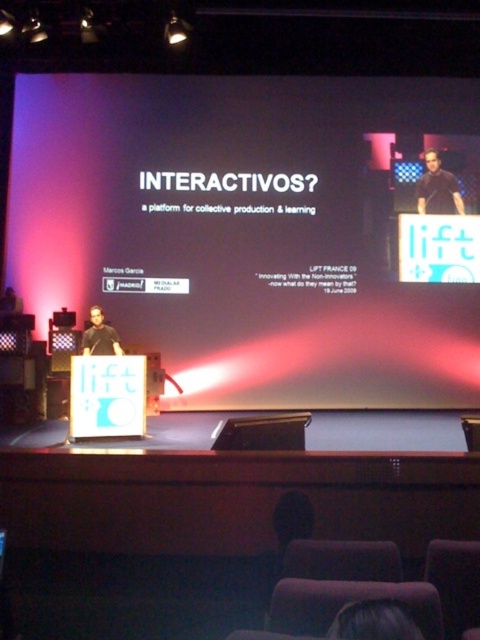
Question: Observing the image, what is the correct spatial positioning of white matte projection screen at upper center in reference to dark brown hair at upper center?

Choices:
 (A) above
 (B) below

Answer: (A)

Question: Which point appears closest to the camera in this image?

Choices:
 (A) (109, 326)
 (B) (417, 186)

Answer: (A)

Question: Does black shirt at upper right have a smaller size compared to matte black shirt at center?

Choices:
 (A) yes
 (B) no

Answer: (A)

Question: Is white matte projection screen at upper center closer to the viewer compared to black shirt at upper right?

Choices:
 (A) no
 (B) yes

Answer: (B)

Question: Which of the following is the closest to the observer?

Choices:
 (A) coord(419,628)
 (B) coord(419,186)

Answer: (A)

Question: Among these points, which one is nearest to the camera?

Choices:
 (A) (458, 394)
 (B) (349, 604)
 (C) (85, 355)
 (D) (462, 209)

Answer: (B)